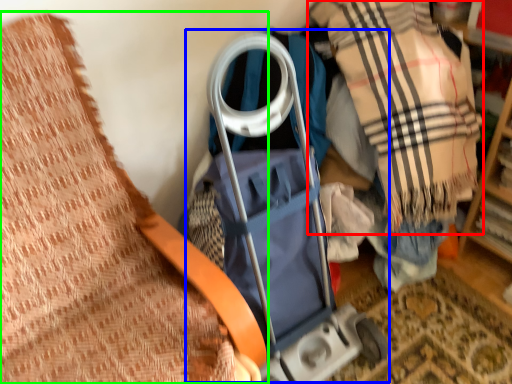
Question: Estimate the real-world distances between objects in this image. Which object is closer to plaid (highlighted by a red box), baby carriage (highlighted by a blue box) or furniture (highlighted by a green box)?

Choices:
 (A) baby carriage
 (B) furniture

Answer: (A)